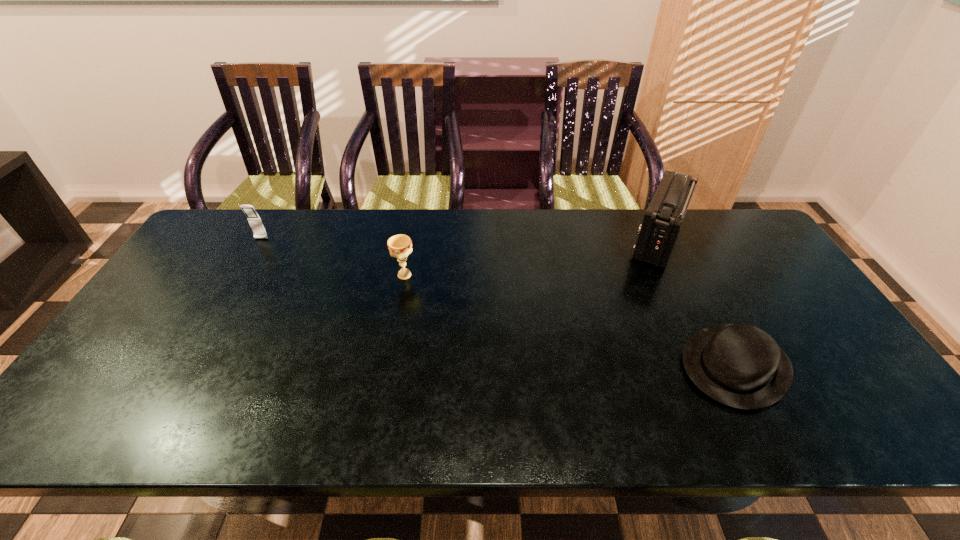
This screenshot has width=960, height=540. In order to click on the tallest object in this screenshot , I will do pyautogui.click(x=662, y=221).

The image size is (960, 540). I want to click on cellular telephone, so click(253, 218).

At what (x,y) coordinates should I click in order to perform the action: click on the second object from left to right. Please return your answer as a coordinate pair (x, y). The width and height of the screenshot is (960, 540). Looking at the image, I should click on (400, 246).

Where is `the shortest object`? Image resolution: width=960 pixels, height=540 pixels. the shortest object is located at coordinates (739, 365).

This screenshot has width=960, height=540. In order to click on the nearest object in this screenshot , I will do `click(739, 365)`.

You are a GUI agent. You are given a task and a screenshot of the screen. Output one action in this format:
    pyautogui.click(x=<x>, y=<y>)
    Task: Click on the free space located on the front panel of the radio receiver
    The height and width of the screenshot is (540, 960).
    Given the screenshot: What is the action you would take?
    pyautogui.click(x=528, y=240)

Locate an element on the screen. This screenshot has width=960, height=540. vacant space situated 0.220m on the front panel of the radio receiver is located at coordinates (556, 240).

Where is `free space located on the front panel of the radio receiver`? free space located on the front panel of the radio receiver is located at coordinates (553, 240).

The image size is (960, 540). What are the coordinates of `vacant space located on the front-facing side of the cellular telephone` in the screenshot? It's located at (243, 269).

Where is `free space located on the left of the third object from right to left`? The height and width of the screenshot is (540, 960). free space located on the left of the third object from right to left is located at coordinates (285, 275).